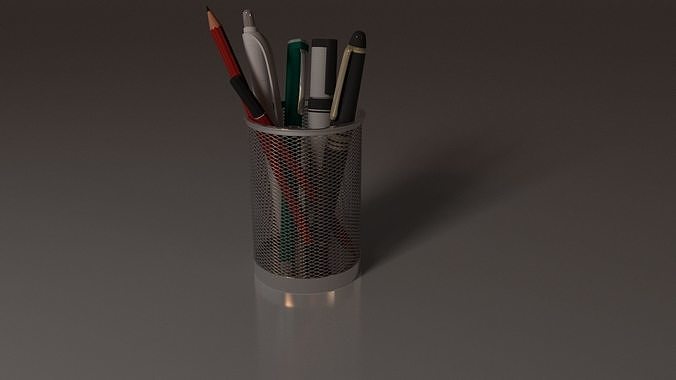
The width and height of the screenshot is (676, 380). In order to click on pen caps in this screenshot , I will do (339, 82), (331, 66), (301, 66), (266, 61).